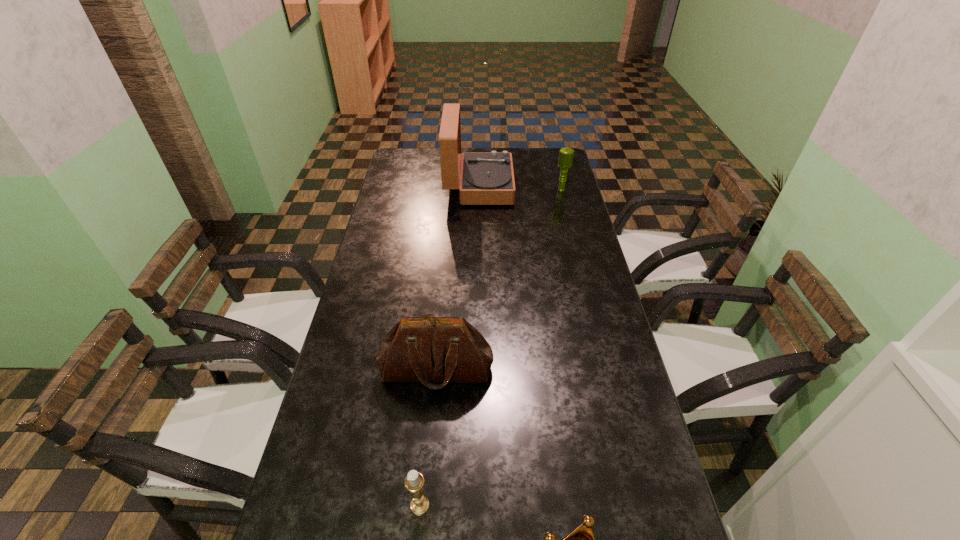
The width and height of the screenshot is (960, 540). What are the coordinates of `object that is at the far edge` in the screenshot? It's located at (487, 178).

Image resolution: width=960 pixels, height=540 pixels. What are the coordinates of `object situated at the left edge` in the screenshot? It's located at (444, 350).

Where is `object present at the right edge`? The image size is (960, 540). object present at the right edge is located at coordinates (565, 160).

Find the location of a particular element. The height and width of the screenshot is (540, 960). blank area at the far edge is located at coordinates (437, 148).

This screenshot has height=540, width=960. In order to click on vacant space at the left edge in this screenshot , I will do `click(361, 274)`.

In the image, there is a desktop. Identify the location of vacant region at the right edge. (571, 177).

At what (x,y) coordinates should I click in order to perform the action: click on vacant area at the far left corner of the desktop. Please return your answer as a coordinate pair (x, y). This screenshot has width=960, height=540. Looking at the image, I should click on pyautogui.click(x=416, y=170).

Locate an element on the screen. This screenshot has height=540, width=960. blank area at the far right corner is located at coordinates (556, 151).

At what (x,y) coordinates should I click in order to perform the action: click on vacant region between the tallest object and the rightmost object. Please return your answer as a coordinate pair (x, y). Looking at the image, I should click on (520, 188).

I want to click on vacant space that is in between the tallest object and the third nearest object, so click(458, 278).